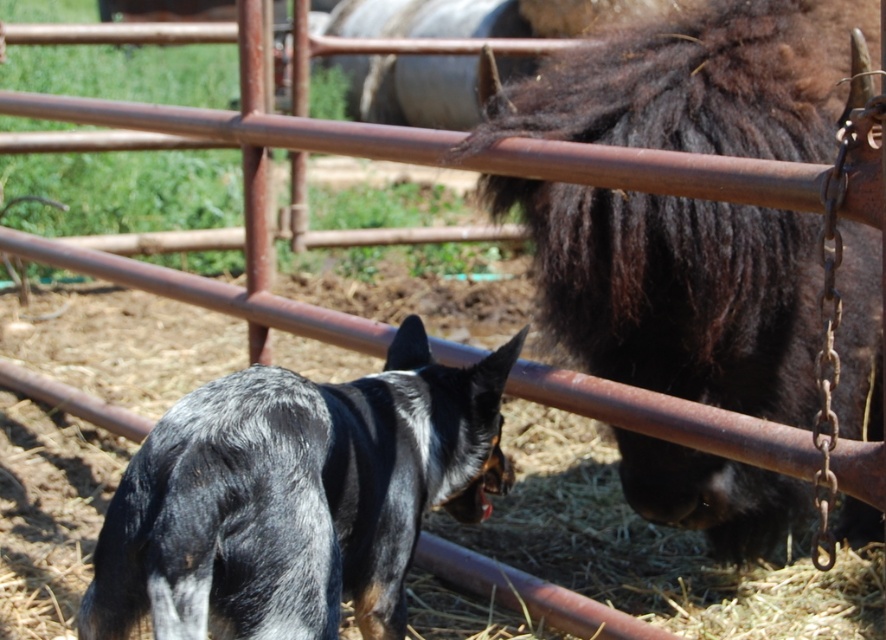
You are standing in a rural area and see the brown fuzzy yak at center and the black and white fur dog at center. Which animal is higher up in the image?

The brown fuzzy yak at center is above the black and white fur dog at center in the image.

You are standing in a rural area and see the brown fuzzy yak at center. If you want to take a photo of it with your camera, which has a minimum focusing distance of 8 feet, will you be able to take a clear photo without moving closer?

The brown fuzzy yak at center is 7.63 feet from camera. Since the minimum focusing distance is 8 feet, you need to move back to ensure the yak is at least 8 feet away for a clear photo.

You are a photographer trying to capture both the brown fuzzy yak at center and the black and white fur dog at center in a single frame. Based on their sizes, which animal should you focus on to ensure both fit comfortably in the photo?

The brown fuzzy yak at center is wider than the black and white fur dog at center, so you should focus on the brown fuzzy yak at center to ensure both fit comfortably in the photo.